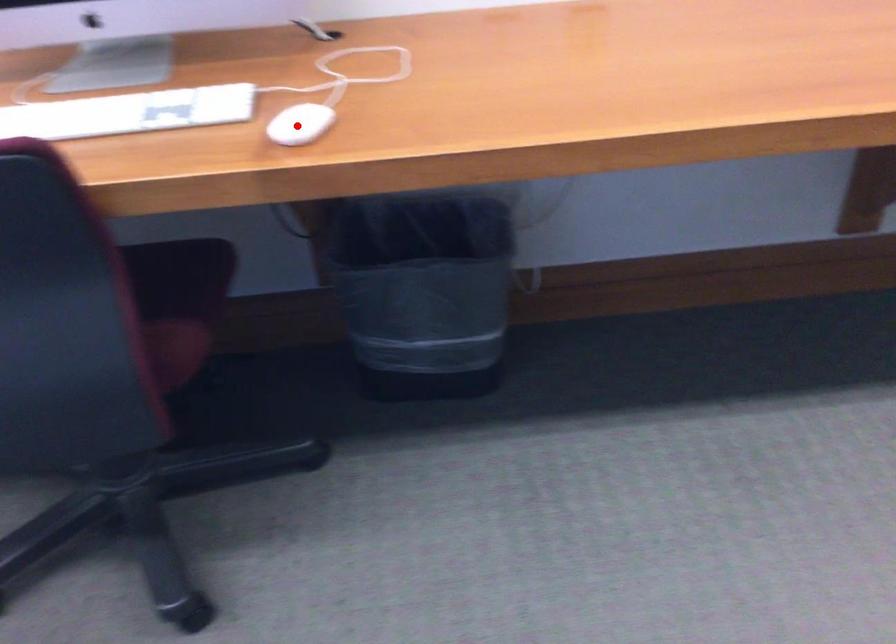
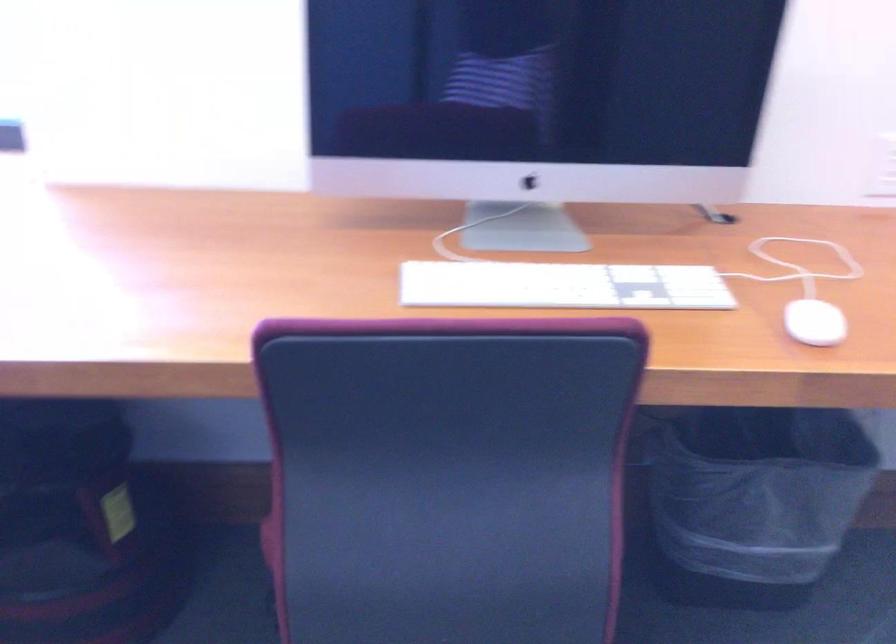
In the second image, find the point that corresponds to the highlighted location in the first image.

(814, 323)